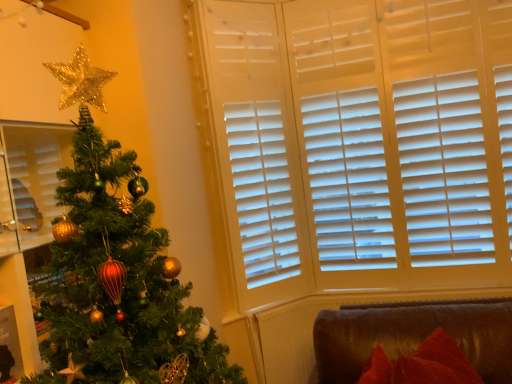
What do you see at coordinates (413, 335) in the screenshot?
I see `velvet red cushion at lower right` at bounding box center [413, 335].

Locate an element on the screen. velvet red cushion at lower right is located at coordinates (413, 335).

What do you see at coordinates (115, 270) in the screenshot? The image size is (512, 384). I see `shiny green christmas tree at left` at bounding box center [115, 270].

Identify the location of shiny green christmas tree at left. (115, 270).

Measure the distance between point [131,252] and camera.

Point [131,252] is 1.14 meters away from camera.

Locate an element on the screen. velvet red cushion at lower right is located at coordinates (413, 335).

Considering the positions of objects shiny green christmas tree at left and velvet red cushion at lower right in the image provided, who is more to the right, shiny green christmas tree at left or velvet red cushion at lower right?

velvet red cushion at lower right is more to the right.

Is shiny green christmas tree at left further to the viewer compared to velvet red cushion at lower right?

No, it is not.

Which is farther, (169,346) or (407,333)?

The point (407,333) is behind.

Based on the photo, from the image's perspective, is shiny green christmas tree at left positioned above or below velvet red cushion at lower right?

Clearly, from the image's perspective, shiny green christmas tree at left is above velvet red cushion at lower right.

From a real-world perspective, which is physically above, shiny green christmas tree at left or velvet red cushion at lower right?

From a 3D spatial view, shiny green christmas tree at left is above.

Considering the relative sizes of shiny green christmas tree at left and velvet red cushion at lower right in the image provided, is shiny green christmas tree at left thinner than velvet red cushion at lower right?

No, shiny green christmas tree at left is not thinner than velvet red cushion at lower right.

Who is taller, shiny green christmas tree at left or velvet red cushion at lower right?

Standing taller between the two is shiny green christmas tree at left.

Can you confirm if shiny green christmas tree at left is bigger than velvet red cushion at lower right?

Correct, shiny green christmas tree at left is larger in size than velvet red cushion at lower right.

Would you say shiny green christmas tree at left contains velvet red cushion at lower right?

No.

Is shiny green christmas tree at left directly adjacent to velvet red cushion at lower right?

No, shiny green christmas tree at left is not making contact with velvet red cushion at lower right.

Does shiny green christmas tree at left turn towards velvet red cushion at lower right?

No, shiny green christmas tree at left is not oriented towards velvet red cushion at lower right.

Where is `christmas tree on the left of the velvet red cushion at lower right`? Image resolution: width=512 pixels, height=384 pixels. christmas tree on the left of the velvet red cushion at lower right is located at coordinates (115, 270).

Considering the relative positions of velvet red cushion at lower right and shiny green christmas tree at left in the image provided, is velvet red cushion at lower right to the left of shiny green christmas tree at left from the viewer's perspective?

No, velvet red cushion at lower right is not to the left of shiny green christmas tree at left.

Who is more distant, velvet red cushion at lower right or shiny green christmas tree at left?

velvet red cushion at lower right is further away from the camera.

Considering the positions of points (358, 308) and (84, 61), is point (358, 308) closer to camera compared to point (84, 61)?

No, (358, 308) is behind (84, 61).

From the picture: From the image's perspective, would you say velvet red cushion at lower right is shown under shiny green christmas tree at left?

Yes.

From a real-world perspective, is velvet red cushion at lower right physically above shiny green christmas tree at left?

No, from a real-world perspective, velvet red cushion at lower right is not on top of shiny green christmas tree at left.

Which of these two, velvet red cushion at lower right or shiny green christmas tree at left, is thinner?

With smaller width is velvet red cushion at lower right.

Does velvet red cushion at lower right have a lesser height compared to shiny green christmas tree at left?

Yes.

Looking at the image, does velvet red cushion at lower right seem bigger or smaller compared to shiny green christmas tree at left?

Considering their sizes, velvet red cushion at lower right takes up less space than shiny green christmas tree at left.

Is velvet red cushion at lower right inside or outside of shiny green christmas tree at left?

velvet red cushion at lower right cannot be found inside shiny green christmas tree at left.

Are velvet red cushion at lower right and shiny green christmas tree at left located far from each other?

Absolutely, velvet red cushion at lower right is distant from shiny green christmas tree at left.

Is shiny green christmas tree at left at the back of velvet red cushion at lower right?

No, velvet red cushion at lower right's orientation is not away from shiny green christmas tree at left.

How different are the orientations of velvet red cushion at lower right and shiny green christmas tree at left in degrees?

The angle between the facing direction of velvet red cushion at lower right and the facing direction of shiny green christmas tree at left is 66.1 degrees.

Where is `furniture behind the shiny green christmas tree at left`? The width and height of the screenshot is (512, 384). furniture behind the shiny green christmas tree at left is located at coordinates (413, 335).

Find the location of a particular element. This screenshot has width=512, height=384. christmas tree located on the left of velvet red cushion at lower right is located at coordinates (115, 270).

This screenshot has height=384, width=512. Find the location of `furniture below the shiny green christmas tree at left (from the image's perspective)`. furniture below the shiny green christmas tree at left (from the image's perspective) is located at coordinates (413, 335).